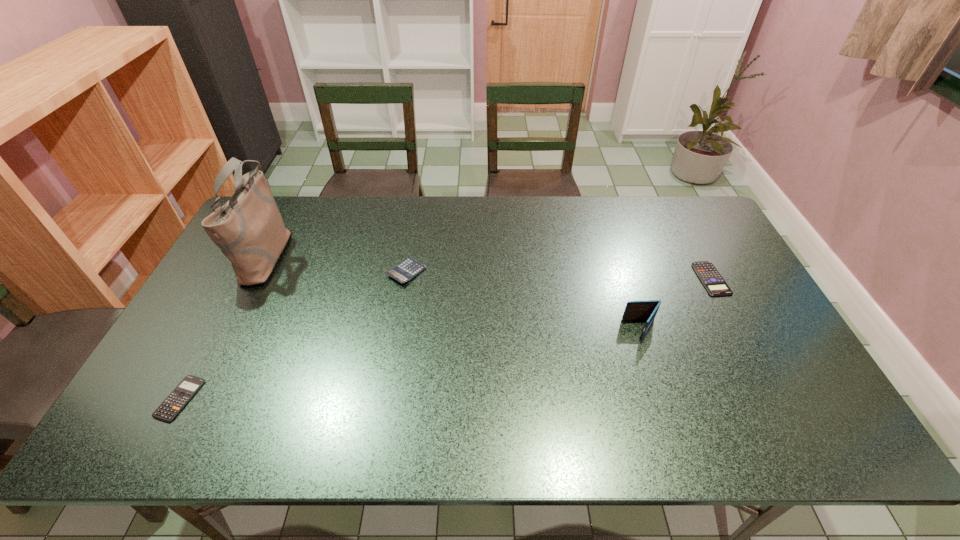
Where is `free spot between the third object from right to left and the rightmost calculator`? free spot between the third object from right to left and the rightmost calculator is located at coordinates (559, 275).

Find the location of a particular element. The width and height of the screenshot is (960, 540). free spot between the nearest object and the shoulder bag is located at coordinates (224, 326).

Where is `blank region between the shortest calculator and the fourth object from left to right`? The image size is (960, 540). blank region between the shortest calculator and the fourth object from left to right is located at coordinates (411, 363).

Where is `vacant area that lies between the nearest calculator and the second calculator from left to right`? The width and height of the screenshot is (960, 540). vacant area that lies between the nearest calculator and the second calculator from left to right is located at coordinates (293, 335).

At what (x,y) coordinates should I click in order to perform the action: click on vacant space in between the wallet and the rightmost calculator. Please return your answer as a coordinate pair (x, y). Looking at the image, I should click on (676, 304).

This screenshot has width=960, height=540. What are the coordinates of `blank region between the second object from right to left and the tallest object` in the screenshot? It's located at (454, 292).

At what (x,y) coordinates should I click in order to perform the action: click on free point between the third object from right to left and the wallet. Please return your answer as a coordinate pair (x, y). The height and width of the screenshot is (540, 960). Looking at the image, I should click on (524, 301).

Locate an element on the screen. This screenshot has height=540, width=960. free spot between the second calculator from left to right and the wallet is located at coordinates (524, 301).

You are a GUI agent. You are given a task and a screenshot of the screen. Output one action in this format:
    pyautogui.click(x=<x>, y=<y>)
    Task: Click on the object that is the closest to the fourth tallest object
    The image size is (960, 540).
    Given the screenshot: What is the action you would take?
    pyautogui.click(x=648, y=309)

In order to click on object that is the third nearest to the shoulder bag in this screenshot , I will do `click(648, 309)`.